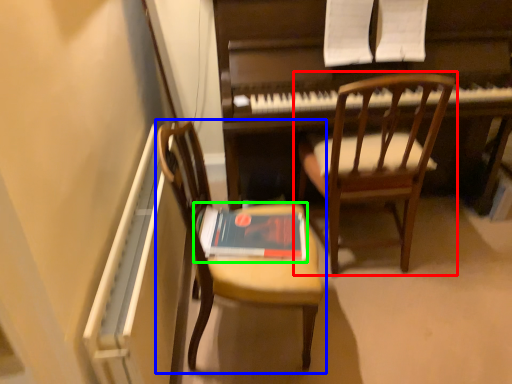
Question: Based on their relative distances, which object is farther from chair (highlighted by a red box)? Choose from chair (highlighted by a blue box) and paperback book (highlighted by a green box).

Choices:
 (A) chair
 (B) paperback book

Answer: (A)